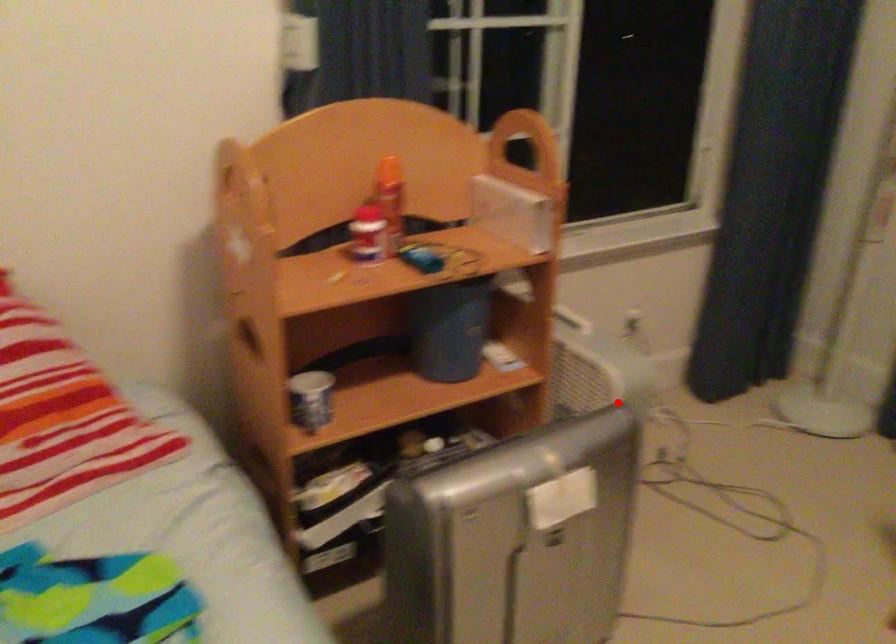
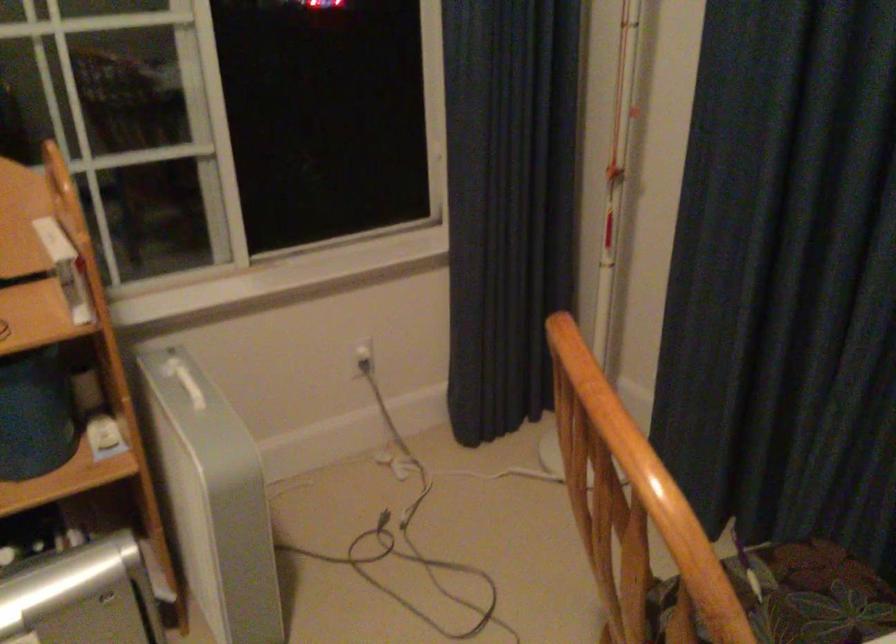
Locate, in the second image, the point that corresponds to the highlighted location in the first image.

(211, 498)